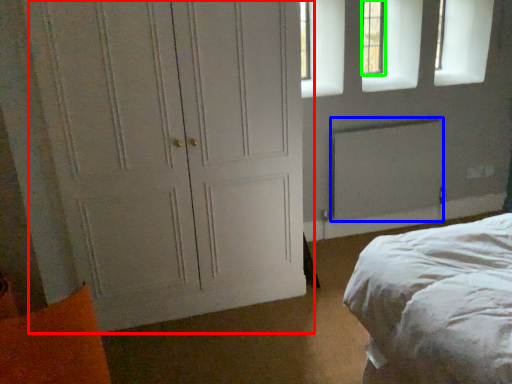
Question: Estimate the real-world distances between objects in this image. Which object is farther from door (highlighted by a red box), radiator (highlighted by a blue box) or window (highlighted by a green box)?

Choices:
 (A) radiator
 (B) window

Answer: (B)